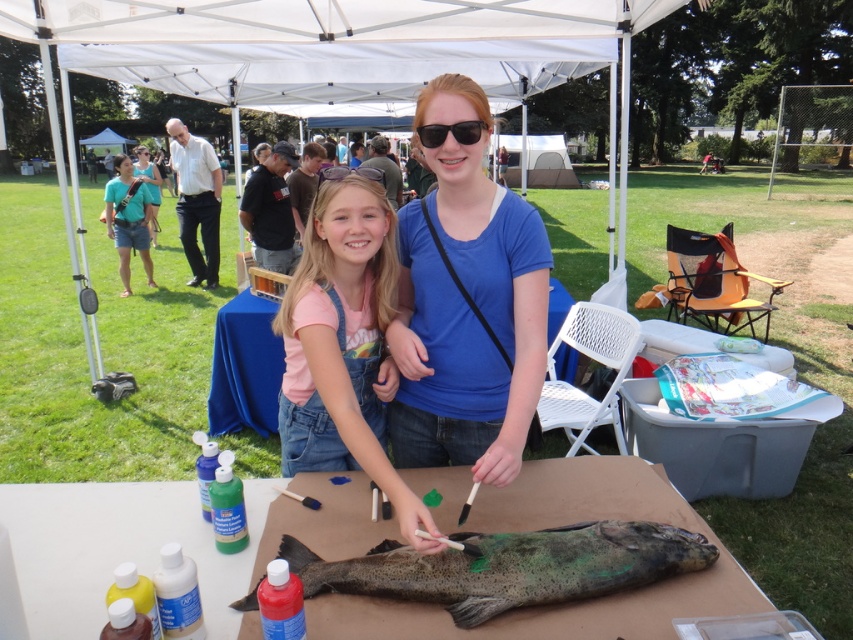
You are a photographer at the event and want to take a photo of both the blue cotton shirt at center and the speckled dark fish at center. However, you notice that the fish is partially obscured. Can you adjust your position so that both are fully visible in the frame?

The speckled dark fish at center is behind the blue cotton shirt at center, so moving your camera position slightly to the side of the blue cotton shirt at center should allow you to see both objects without obstruction.

You are a photographer planning to take a photo of the speckled dark fish at center under the white fabric canopy at upper center. Since you want the fish to be the main focus, will the canopy cover the fish entirely when you frame the shot?

The white fabric canopy at upper center is wider than the speckled dark fish at center, so it will cover the fish entirely when framed in the photo.